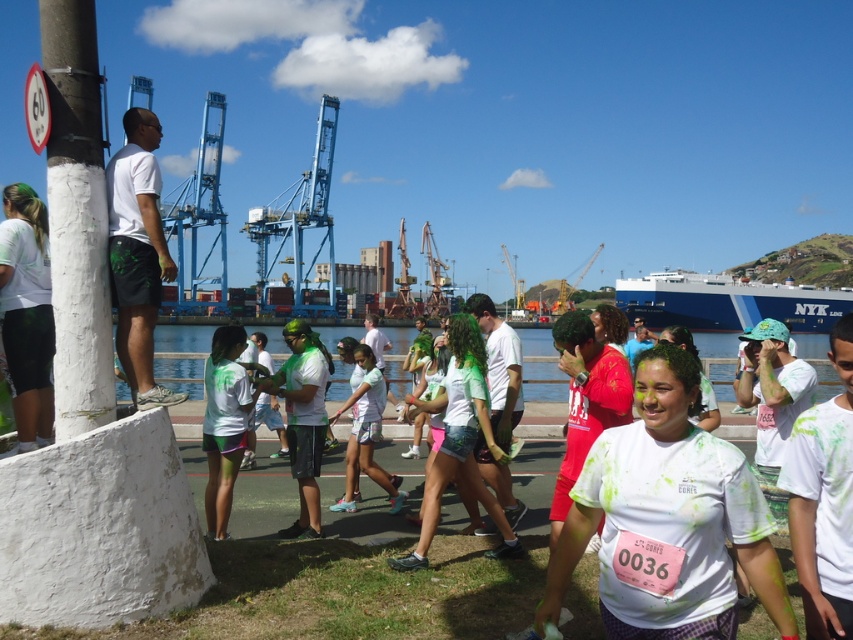
Question: In this image, where is white matte shirt at center located relative to white matte shorts at left?

Choices:
 (A) right
 (B) left

Answer: (A)

Question: Among these points, which one is farthest from the camera?

Choices:
 (A) (795, 294)
 (B) (351, 490)
 (C) (648, 484)

Answer: (A)

Question: Which point is farther to the camera?

Choices:
 (A) (32, 417)
 (B) (91, 396)

Answer: (A)

Question: Which point is closer to the camera taking this photo?

Choices:
 (A) (7, 298)
 (B) (733, 496)
 (C) (83, 3)
 (D) (756, 316)

Answer: (B)

Question: Can you confirm if white textured pole at left is positioned below matte green shirt at center?

Choices:
 (A) yes
 (B) no

Answer: (B)

Question: Can you confirm if white textured pole at left is positioned to the right of light blue fabric shorts at center?

Choices:
 (A) yes
 (B) no

Answer: (B)